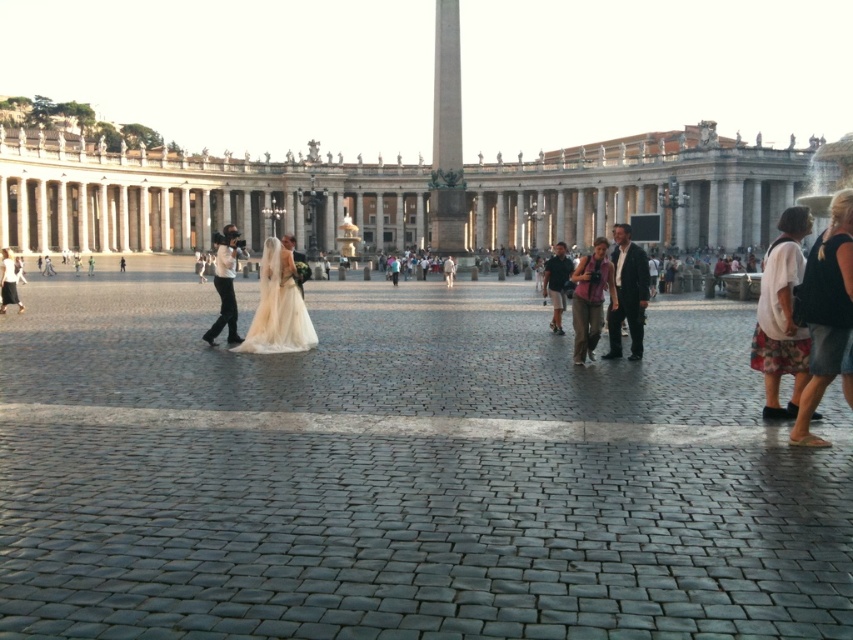
Question: Which object appears closest to the camera in this image?

Choices:
 (A) smooth stone plaza at center
 (B) pink fabric purse at center
 (C) white cotton blouse at right

Answer: (A)

Question: Is dark gray suit at center above white cotton dress at lower left?

Choices:
 (A) no
 (B) yes

Answer: (B)

Question: Is ivory satin dress at center to the right of white cotton dress at lower left from the viewer's perspective?

Choices:
 (A) yes
 (B) no

Answer: (A)

Question: Which of these objects is positioned closest to the white cotton dress at lower left?

Choices:
 (A) white cotton shirt at center
 (B) pink fabric purse at center
 (C) white marble palace at center
 (D) ivory satin dress at center

Answer: (A)

Question: Is the position of white marble palace at center more distant than that of dark gray suit at center?

Choices:
 (A) yes
 (B) no

Answer: (A)

Question: Considering the real-world distances, which object is closest to the denim skirt at right?

Choices:
 (A) white cotton dress at lower left
 (B) white cotton shirt at center
 (C) ivory satin dress at center
 (D) dark green fabric shirt at center

Answer: (D)